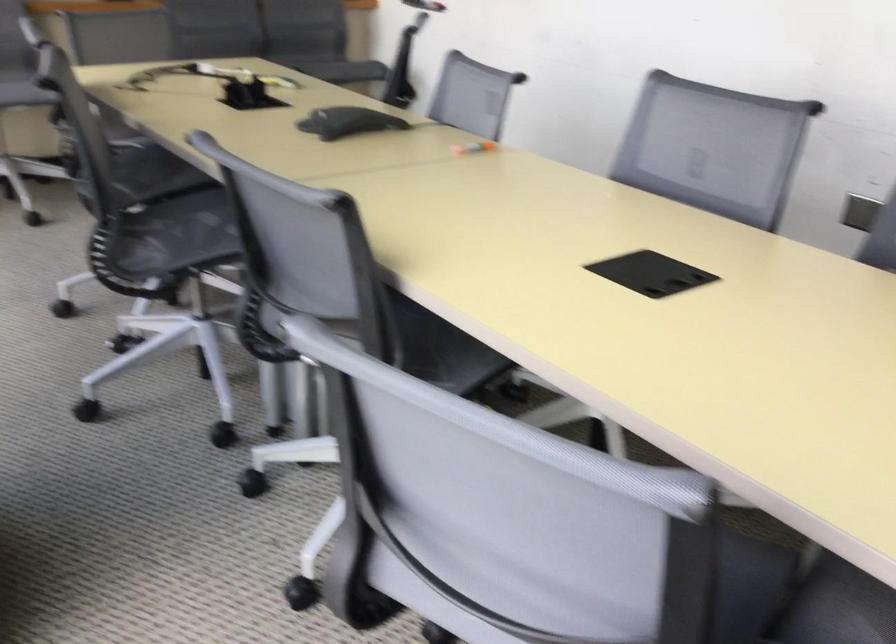
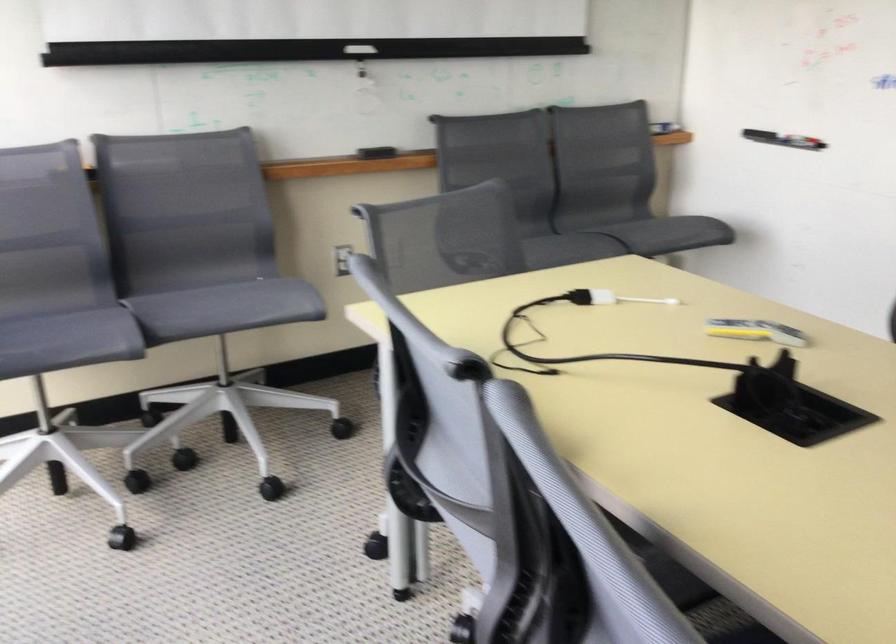
Find the pixel in the second image that matches point (218, 71) in the first image.

(610, 298)